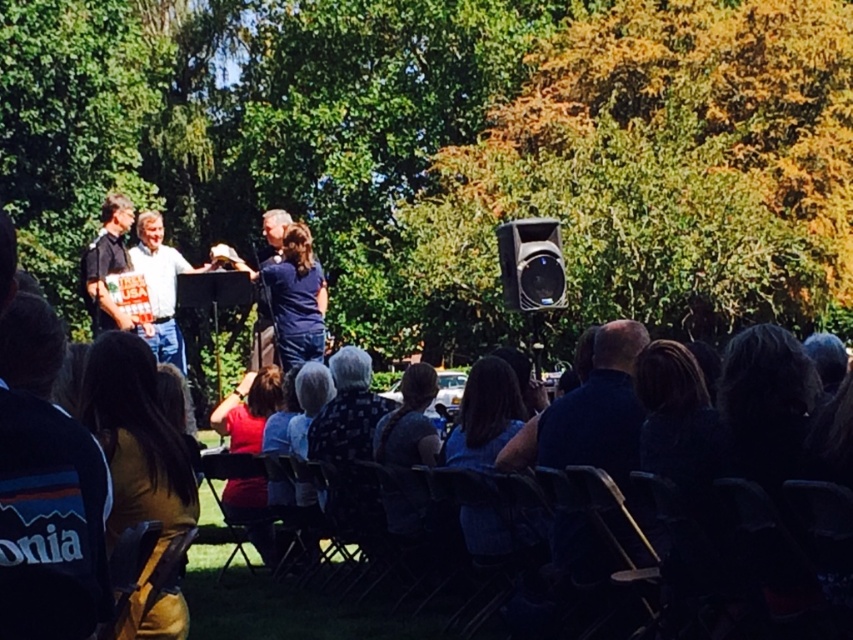
Based on the photo, you are organizing a photo shoot and need to position two models wearing the dark blue jacket at lower left and the white shirt at center. Given their sizes, which model should you place closer to the camera to ensure both appear proportionate in the final image?

Since the dark blue jacket at lower left is smaller in size compared to the white shirt at center, you should position the model wearing the dark blue jacket at lower left closer to the camera to balance their apparent sizes in the photo.

You are attending an outdoor event in a park and notice two jackets at the lower left corner of your view. Which jacket is positioned more to the right between the dark blue jacket at lower left and the dark brown leather jacket at lower left?

The dark blue jacket at lower left is positioned more to the right compared to the dark brown leather jacket at lower left.